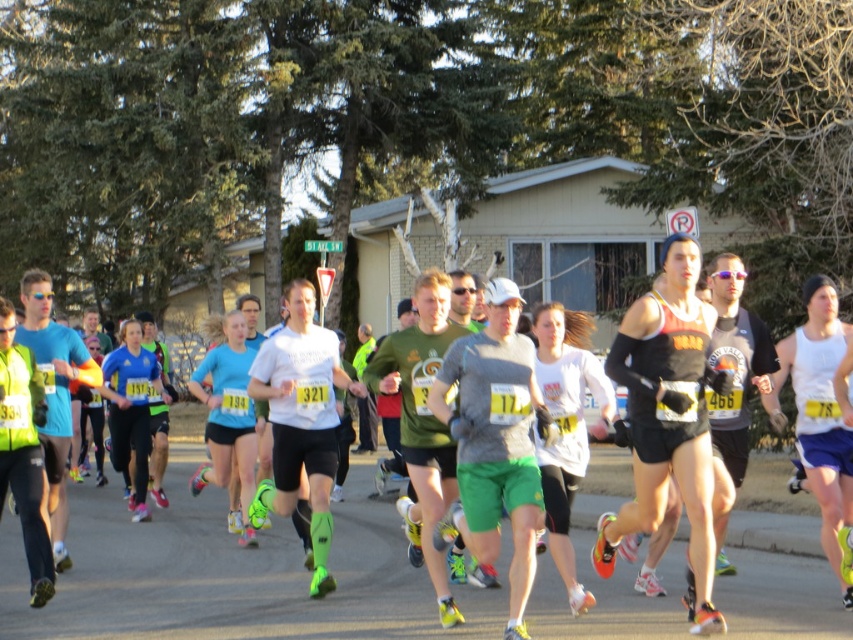
Question: Among these objects, which one is farthest from the camera?

Choices:
 (A) white fabric tank top at center
 (B) gray matte shirt at center

Answer: (A)

Question: Is gray matte shirt at center bigger than white fabric tank top at center?

Choices:
 (A) no
 (B) yes

Answer: (B)

Question: Does gray matte shirt at center appear on the right side of white fabric tank top at center?

Choices:
 (A) no
 (B) yes

Answer: (A)

Question: Which object appears farthest from the camera in this image?

Choices:
 (A) gray matte shirt at center
 (B) white fabric tank top at center

Answer: (B)

Question: In this image, where is gray matte shirt at center located relative to white fabric tank top at center?

Choices:
 (A) below
 (B) above

Answer: (A)

Question: Which of the following is the closest to the observer?

Choices:
 (A) white fabric tank top at center
 (B) gray matte shirt at center

Answer: (B)